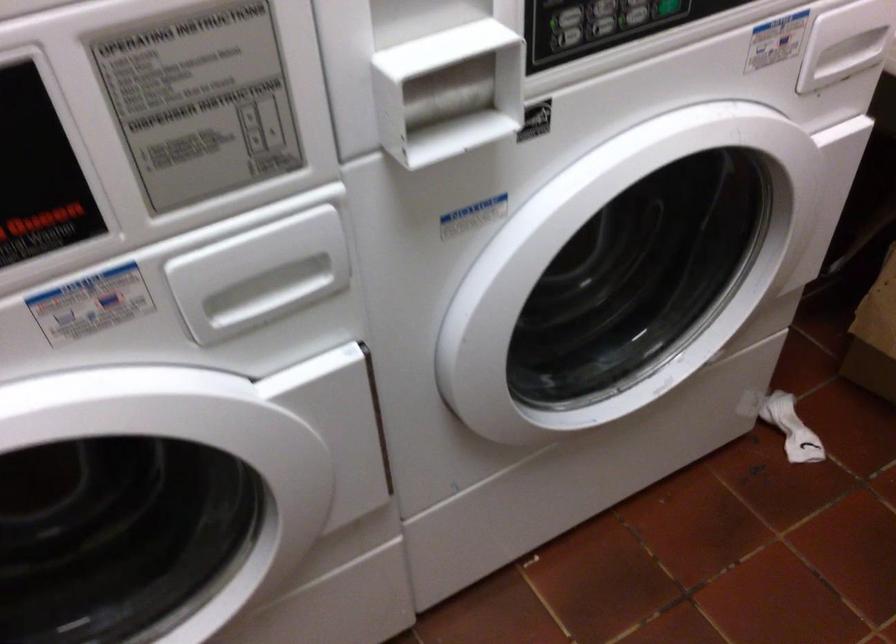
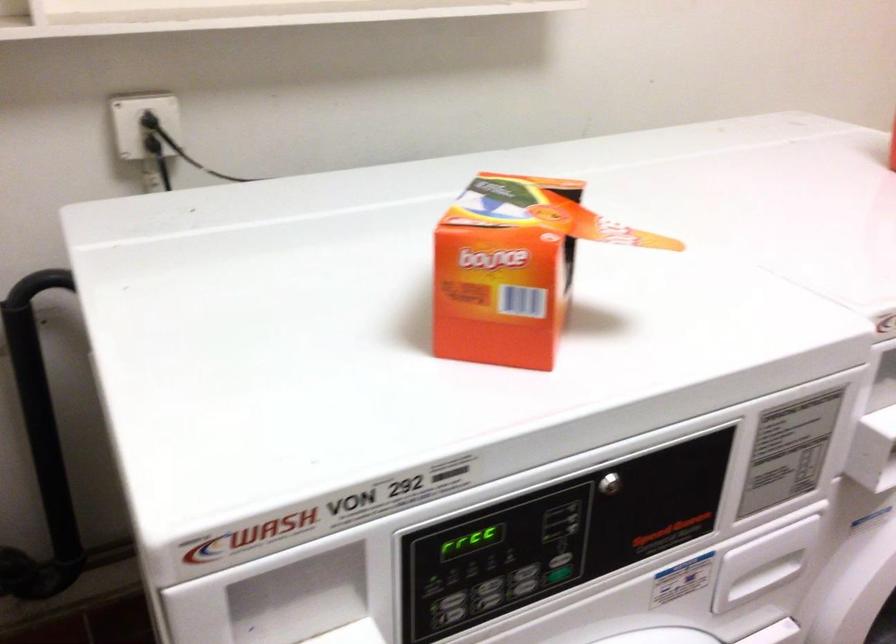
Locate, in the second image, the point that corresponds to the point at 248,276 in the first image.

(762, 576)